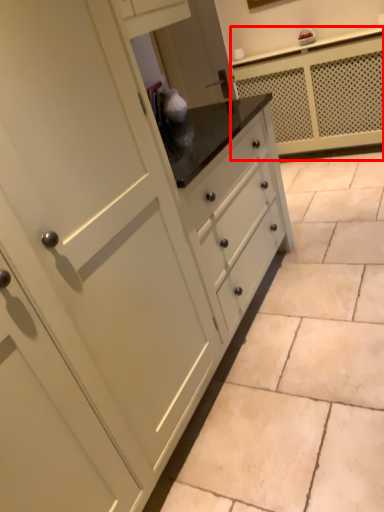
Question: From the image's perspective, where is counter (annotated by the red box) located relative to ceramic tile?

Choices:
 (A) below
 (B) above

Answer: (B)